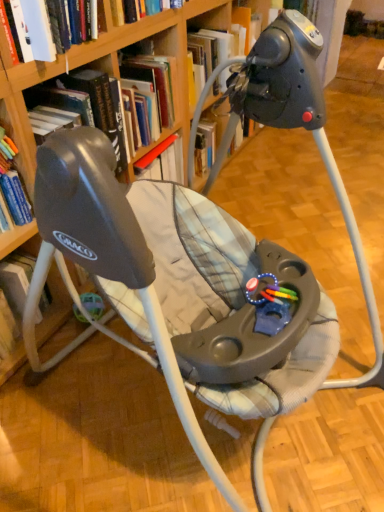
Question: In the image, is hardcover book at upper left, acting as the 1th book starting from the bottom, positioned in front of or behind rubberized plastic teething toy at center?

Choices:
 (A) behind
 (B) front

Answer: (A)

Question: Is hardcover book at upper left, which appears as the second book when viewed from the top, wider or thinner than rubberized plastic teething toy at center?

Choices:
 (A) thin
 (B) wide

Answer: (B)

Question: Which is nearer to the rubberized plastic teething toy at center?

Choices:
 (A) hardcover book at upper left, which appears as the second book when viewed from the top
 (B) hardcover book at upper center, acting as the first book starting from the top
 (C) wooden bookcase at upper center

Answer: (C)

Question: Considering the real-world distances, which object is farthest from the hardcover book at upper center, acting as the first book starting from the top?

Choices:
 (A) wooden bookcase at upper center
 (B) hardcover book at upper left, which appears as the second book when viewed from the top
 (C) rubberized plastic teething toy at center

Answer: (C)